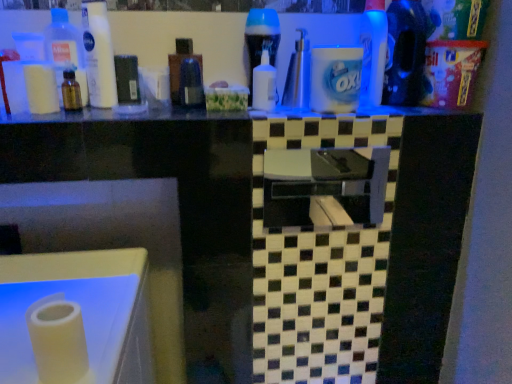
The width and height of the screenshot is (512, 384). Find the location of `free space to the right of white matte bottle at center, the fifth bottle viewed from the left`. free space to the right of white matte bottle at center, the fifth bottle viewed from the left is located at coordinates (334, 110).